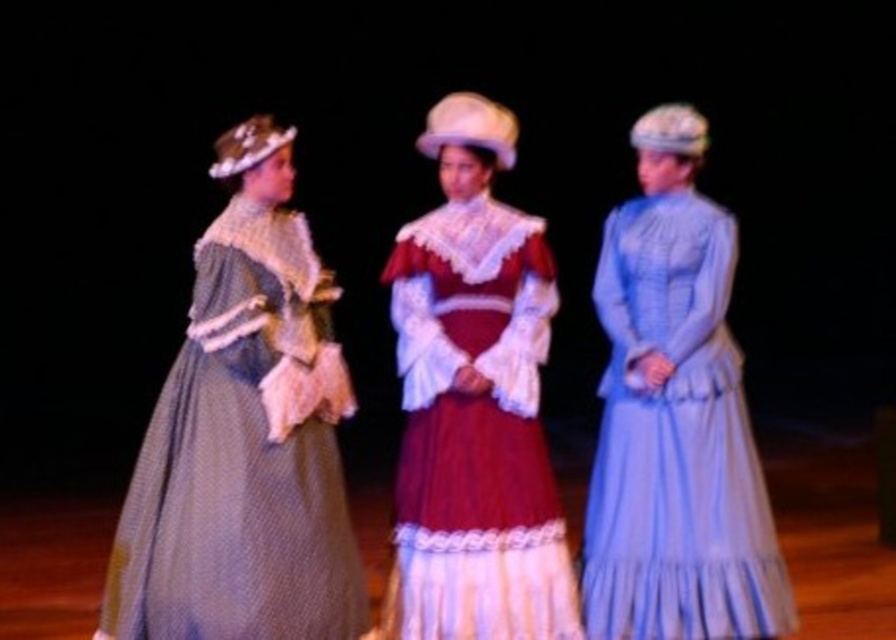
Is polka dot fabric dress at left positioned in front of velvet maroon dress at center?

Yes.

Between polka dot fabric dress at left and velvet maroon dress at center, which one has more height?

velvet maroon dress at center is taller.

This screenshot has width=896, height=640. Describe the element at coordinates (244, 436) in the screenshot. I see `polka dot fabric dress at left` at that location.

Find the location of `polka dot fabric dress at left`. polka dot fabric dress at left is located at coordinates (244, 436).

Is point (616, 426) more distant than point (498, 465)?

Yes.

Between light blue satin dress at center and velvet maroon dress at center, which one appears on the right side from the viewer's perspective?

light blue satin dress at center

What do you see at coordinates (675, 419) in the screenshot? I see `light blue satin dress at center` at bounding box center [675, 419].

In order to click on light blue satin dress at center in this screenshot , I will do `click(675, 419)`.

Which is more to the right, polka dot fabric dress at left or light blue satin dress at center?

light blue satin dress at center

Is the position of polka dot fabric dress at left more distant than that of light blue satin dress at center?

No, it is in front of light blue satin dress at center.

Does point (270, 579) come farther from viewer compared to point (757, 541)?

No, it is not.

Where is `polka dot fabric dress at left`? polka dot fabric dress at left is located at coordinates [x=244, y=436].